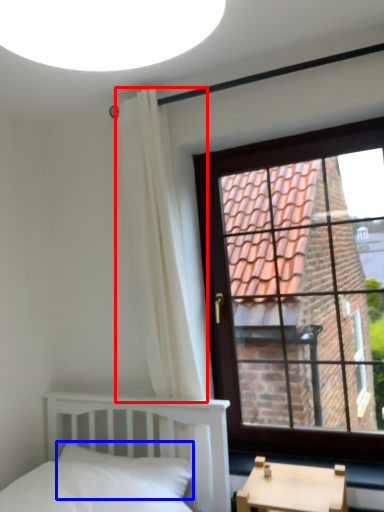
Question: Which object is further to the camera taking this photo, curtain (highlighted by a red box) or pillow (highlighted by a blue box)?

Choices:
 (A) curtain
 (B) pillow

Answer: (A)